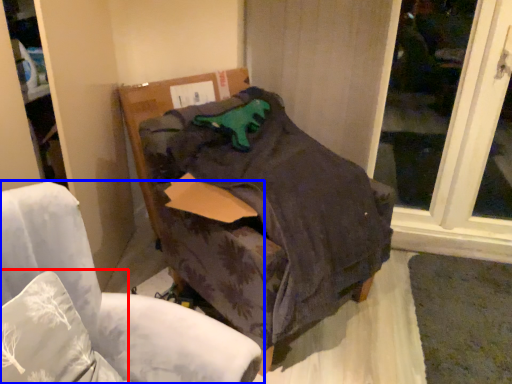
Question: Which point is further to the camera, pillow (highlighted by a red box) or chair (highlighted by a blue box)?

Choices:
 (A) pillow
 (B) chair

Answer: (A)